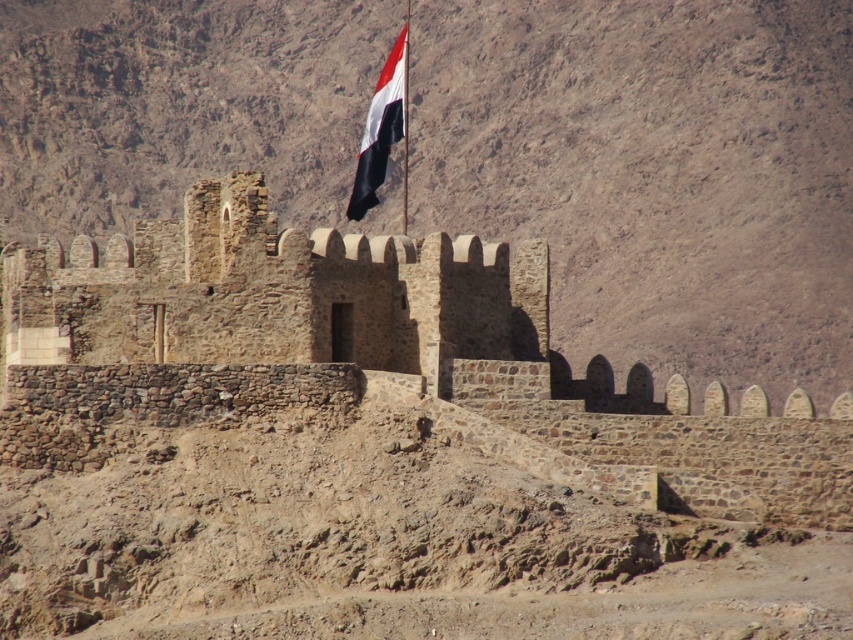
You are a historian examining an old map of a rugged, arid landscape. On the map, there is a point marked at coordinates (375, 358). Based on the image description provided, what does this point most likely represent?

The point at (375, 358) most likely represents the rustic stone castle at center, as the Objects Description specifies that this coordinate indicates that location.

Consider the image. You are a historian examining the image of a rustic stone castle at center and a white fabric flag at upper center. Based on the scene, which object occupies a larger area in the image?

The white fabric flag at upper center occupies a larger area in the image than the rustic stone castle at center, as the castle is smaller than the flag.